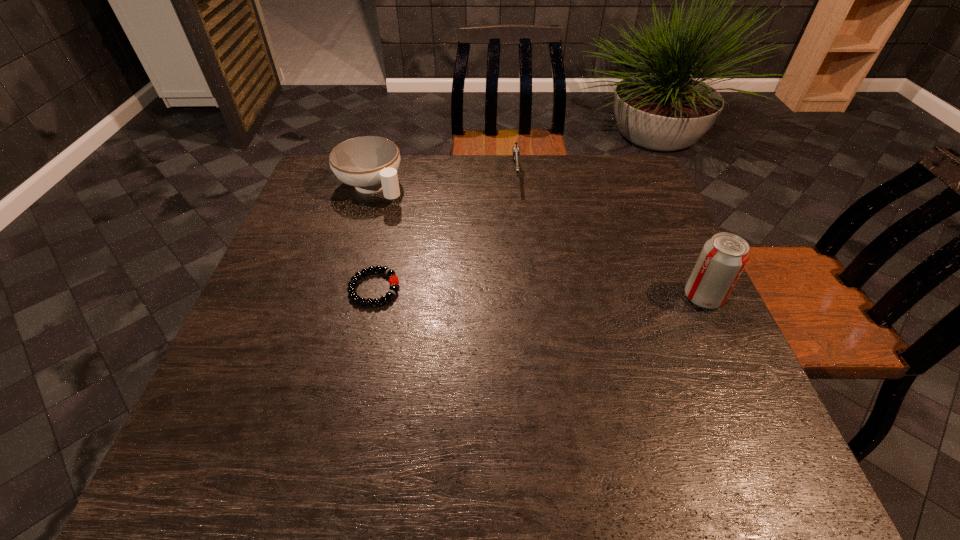
What are the coordinates of `vacant space on the desktop that is between the bracelet and the rightmost object and is positioned on the side with the handle of the chinaware` in the screenshot? It's located at (491, 292).

The height and width of the screenshot is (540, 960). I want to click on free space on the desktop that is between the shortest object and the tallest object and is positioned on the front-facing side of the second shortest object, so click(523, 292).